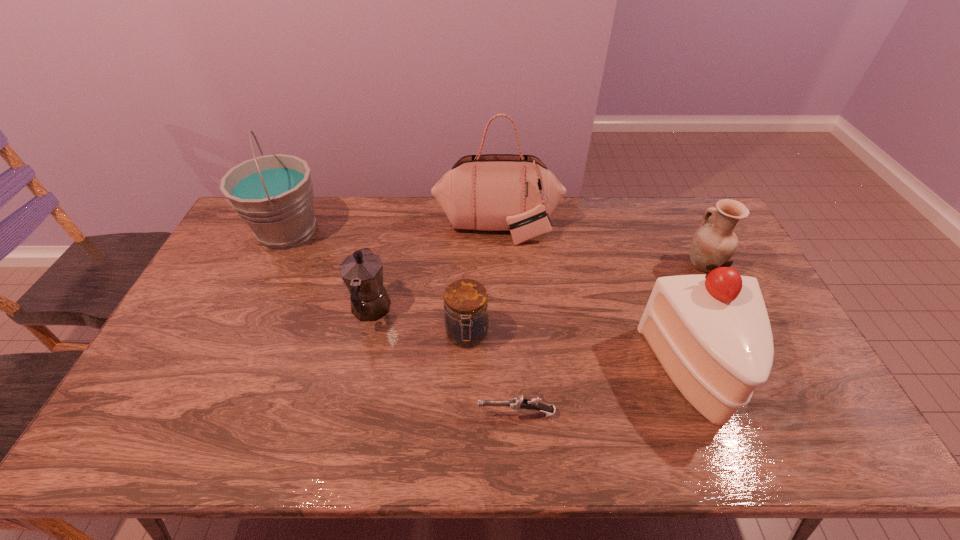
The width and height of the screenshot is (960, 540). I want to click on free space located 0.260m on the left of the pottery, so click(x=606, y=265).

Identify the location of vacant region located 0.160m on the pouring side of the coffeepot. This screenshot has height=540, width=960. (384, 252).

Identify the location of vacant space situated on the pouring side of the coffeepot. This screenshot has width=960, height=540. (384, 252).

Image resolution: width=960 pixels, height=540 pixels. Find the location of `vacant space located on the pouring side of the coffeepot`. vacant space located on the pouring side of the coffeepot is located at coordinates (384, 252).

You are a GUI agent. You are given a task and a screenshot of the screen. Output one action in this format:
    pyautogui.click(x=<x>, y=<y>)
    Task: Click on the free space located on the lid of the jar
    This screenshot has height=540, width=960.
    Given the screenshot: What is the action you would take?
    pyautogui.click(x=466, y=376)

Image resolution: width=960 pixels, height=540 pixels. I want to click on blank area located 0.180m aimed along the barrel of the gun, so click(x=406, y=414).

Locate an element on the screen. The image size is (960, 540). vacant region located aimed along the barrel of the gun is located at coordinates (390, 414).

Identify the location of blank area located aimed along the barrel of the gun. (325, 414).

This screenshot has height=540, width=960. I want to click on handbag that is at the far edge, so click(x=493, y=192).

Locate an element on the screen. The height and width of the screenshot is (540, 960). bucket that is at the far edge is located at coordinates (273, 194).